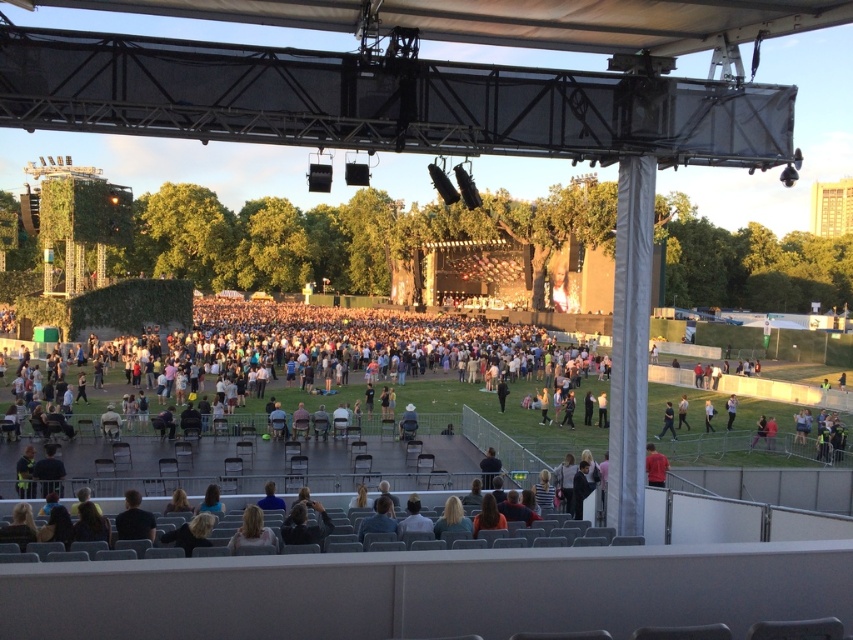
You are a photographer at the concert and want to capture a photo of the red shirt at center and the black fabric pants at lower right in the same frame. Based on their positions, which object should you focus on first to ensure both are in the shot?

Since the red shirt at center is to the left of black fabric pants at lower right, you should focus on the red shirt at center first to ensure both are in the shot.

You are a photographer positioned at the front of the concert venue. You need to capture a photo that includes both the red shirt at center and the black fabric pants at lower right. Which object should you focus on first to ensure both are in sharp focus?

The red shirt at center is closer to the viewer than the black fabric pants at lower right. To ensure both are in sharp focus, you should focus on the red shirt at center first, as it is the closer object, and adjust the depth of field accordingly.

You are at the front of the concert stage and want to locate the red shirt at center. Which direction should you look to find it?

The red shirt at center is located at point [654,467], so you should look to the upper right direction from your current position at the front of the stage.